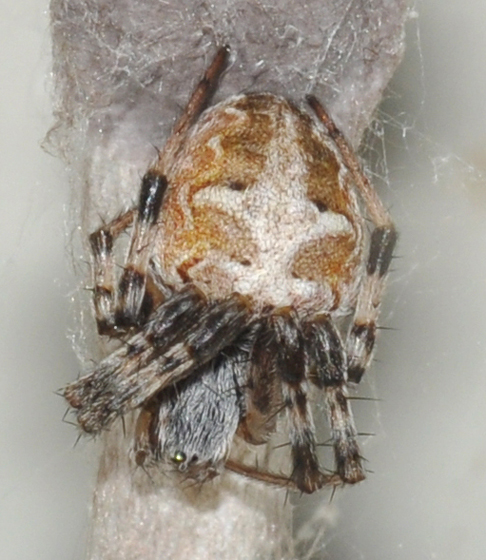
Find the location of a particular element. The height and width of the screenshot is (560, 486). white walls is located at coordinates (450, 304), (14, 322).